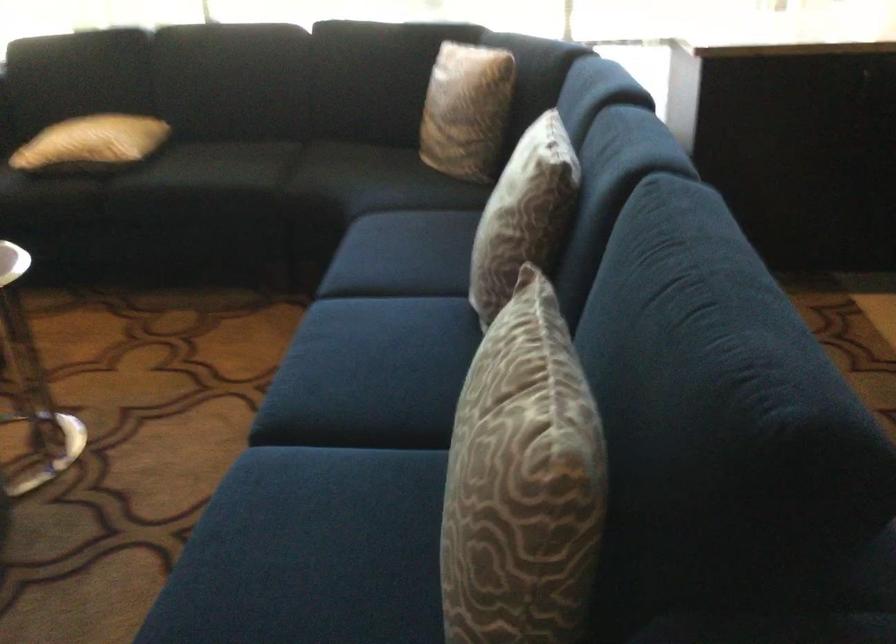
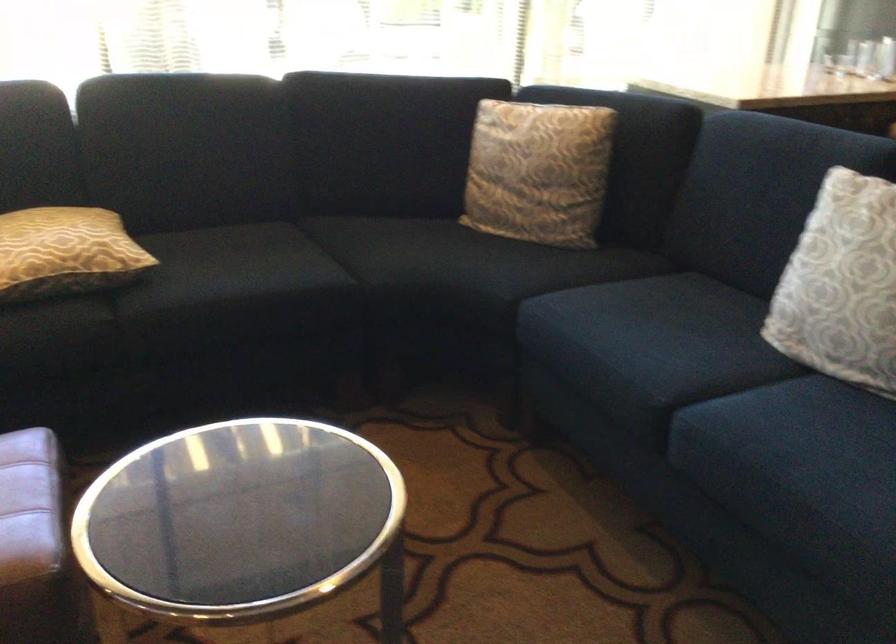
Locate, in the second image, the point that corresponds to the point at 78,143 in the first image.

(65, 252)